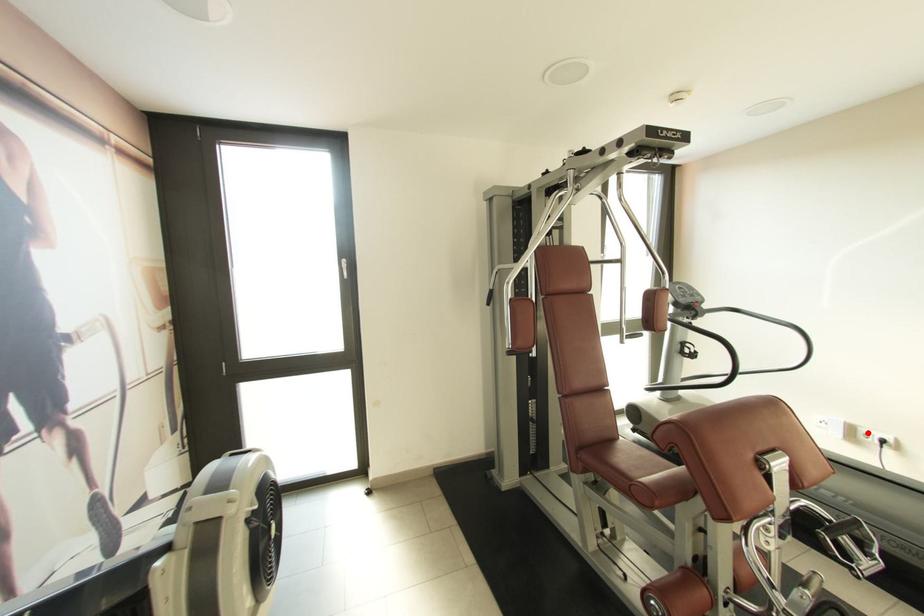
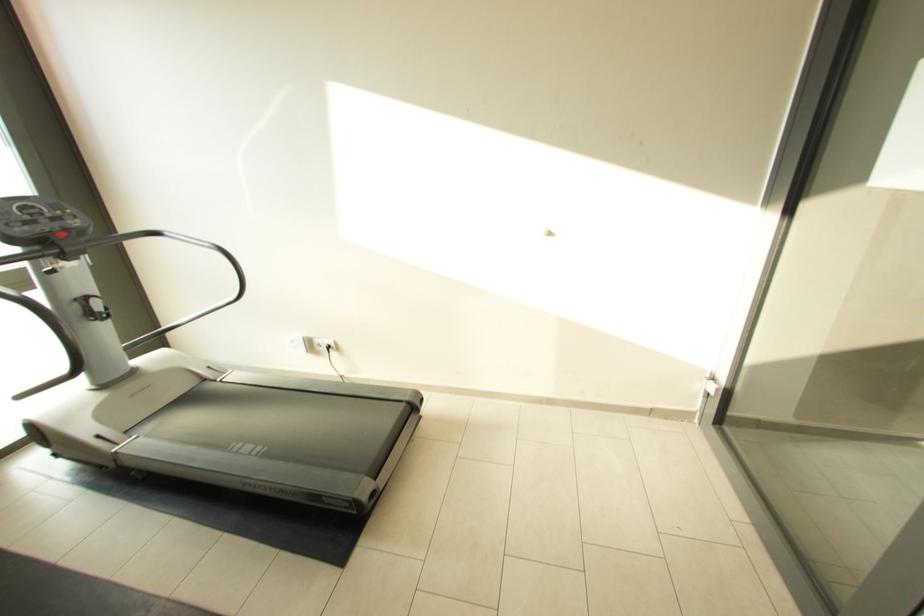
Question: I am providing you with two images of the same scene from different viewpoints. In image1, a red point is highlighted. Considering the same 3D point in image2, which of the following is correct?

Choices:
 (A) It is closer
 (B) It is farther

Answer: (B)